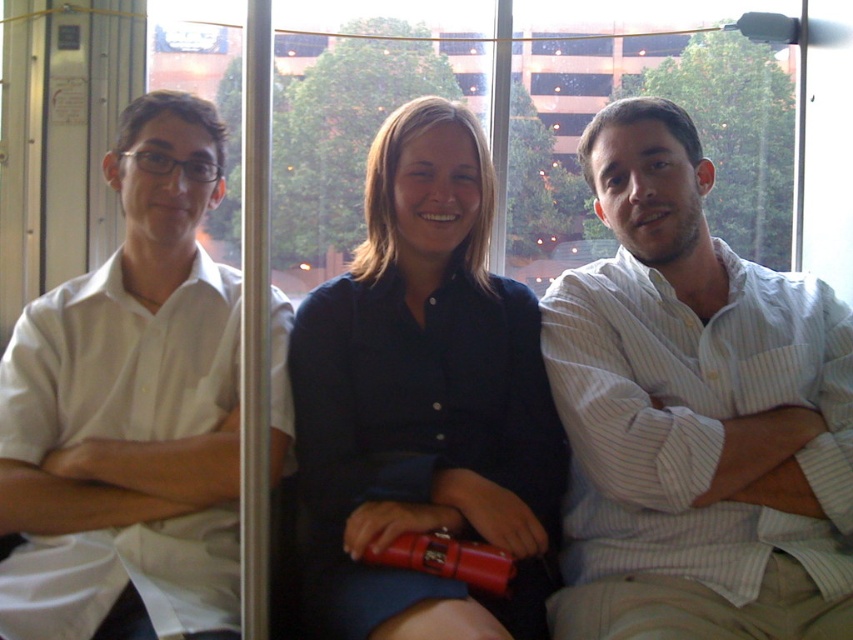
What are the coordinates of the white striped shirt at center?

The white striped shirt at center is located at coordinates point (694, 413).

You are trying to identify which person is closer to you based on their clothing. There are two people wearing white shirts here, a white striped shirt at center and a white smooth shirt at left. Which one is nearer to your current position?

The white striped shirt at center is closer to the viewer than the white smooth shirt at left, so the person wearing the white striped shirt at center is nearer to you.